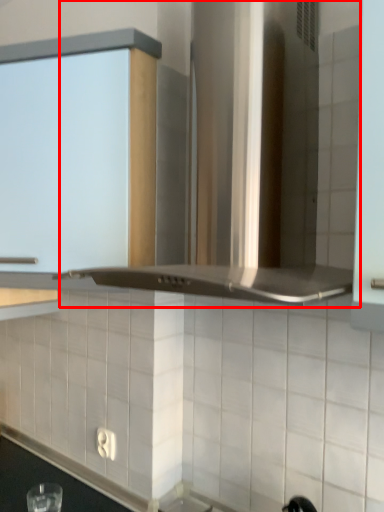
Question: Observing the image, what is the correct spatial positioning of vent (annotated by the red box) in reference to cabinetry?

Choices:
 (A) left
 (B) right

Answer: (B)